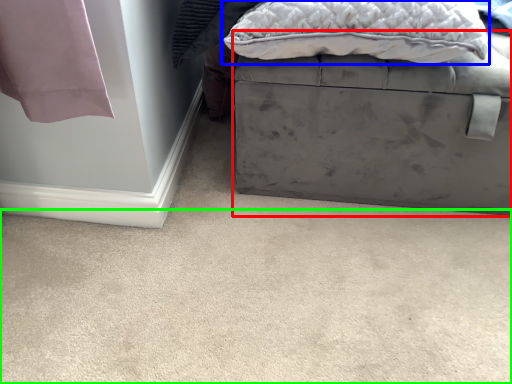
Question: Based on their relative distances, which object is farther from furniture (highlighted by a red box)? Choose from pillow (highlighted by a blue box) and concrete (highlighted by a green box).

Choices:
 (A) pillow
 (B) concrete

Answer: (B)